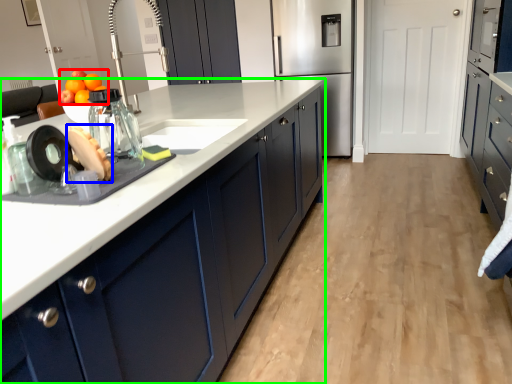
Question: Which object is the farthest from fruit (highlighted by a red box)? Choose among these: food (highlighted by a blue box) or cabinetry (highlighted by a green box).

Choices:
 (A) food
 (B) cabinetry

Answer: (A)